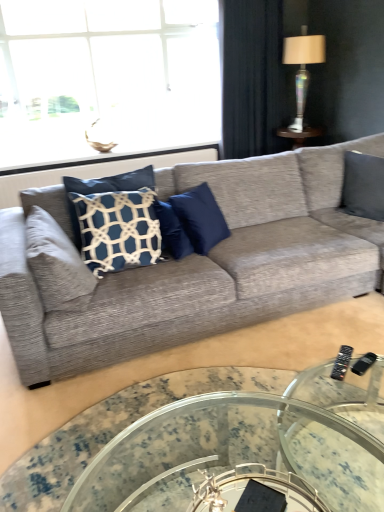
Question: Considering the relative sizes of dark blue fabric curtain at upper right and textured gray couch at center in the image provided, is dark blue fabric curtain at upper right shorter than textured gray couch at center?

Choices:
 (A) yes
 (B) no

Answer: (B)

Question: Can you confirm if dark blue fabric curtain at upper right is smaller than textured gray couch at center?

Choices:
 (A) yes
 (B) no

Answer: (A)

Question: Considering the relative sizes of dark blue fabric curtain at upper right and textured gray couch at center in the image provided, is dark blue fabric curtain at upper right taller than textured gray couch at center?

Choices:
 (A) yes
 (B) no

Answer: (A)

Question: Is dark blue fabric curtain at upper right at the left side of textured gray couch at center?

Choices:
 (A) yes
 (B) no

Answer: (B)

Question: From a real-world perspective, is dark blue fabric curtain at upper right positioned under textured gray couch at center based on gravity?

Choices:
 (A) yes
 (B) no

Answer: (B)

Question: Is dark blue fabric curtain at upper right in front of textured gray couch at center?

Choices:
 (A) yes
 (B) no

Answer: (B)

Question: From a real-world perspective, does black plastic remote at lower right stand above white textured pillow at left, which appears as the 2th pillow when viewed from the right?

Choices:
 (A) yes
 (B) no

Answer: (B)

Question: Does black plastic remote at lower right turn towards white textured pillow at left, which appears as the 2th pillow when viewed from the right?

Choices:
 (A) yes
 (B) no

Answer: (B)

Question: Is black plastic remote at lower right bigger than white textured pillow at left, which appears as the 2th pillow when viewed from the right?

Choices:
 (A) yes
 (B) no

Answer: (B)

Question: From a real-world perspective, is black plastic remote at lower right below white textured pillow at left, placed as the 1th pillow when sorted from left to right?

Choices:
 (A) yes
 (B) no

Answer: (A)

Question: Is black plastic remote at lower right wider than white textured pillow at left, which appears as the 2th pillow when viewed from the right?

Choices:
 (A) no
 (B) yes

Answer: (A)

Question: Considering the relative sizes of black plastic remote at lower right and white textured pillow at left, which appears as the 2th pillow when viewed from the right, in the image provided, is black plastic remote at lower right smaller than white textured pillow at left, which appears as the 2th pillow when viewed from the right,?

Choices:
 (A) yes
 (B) no

Answer: (A)

Question: Does clear glass window at upper left lie in front of white textured pillow at left, placed as the 1th pillow when sorted from left to right?

Choices:
 (A) yes
 (B) no

Answer: (B)